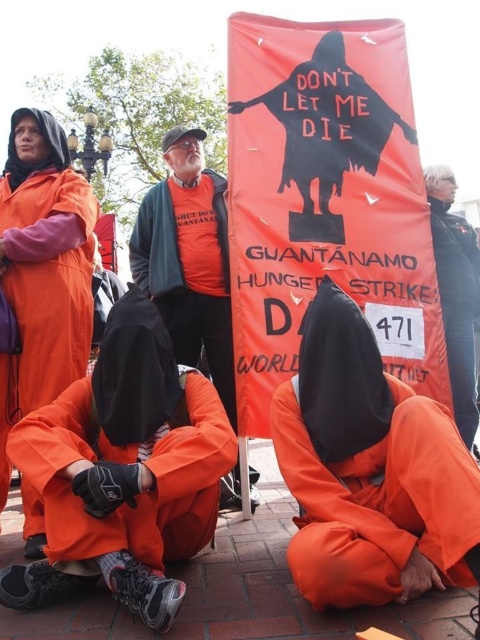
Question: Does orange cotton shirt at center have a greater width compared to orange fabric shirt at upper right?

Choices:
 (A) yes
 (B) no

Answer: (A)

Question: Which point appears closest to the camera in this image?

Choices:
 (A) (425, 189)
 (B) (163, 188)

Answer: (A)

Question: Can you confirm if orange cotton shirt at center is positioned below orange fabric shirt at upper right?

Choices:
 (A) yes
 (B) no

Answer: (B)

Question: Is orange cotton shirt at center below orange fabric shirt at upper right?

Choices:
 (A) yes
 (B) no

Answer: (B)